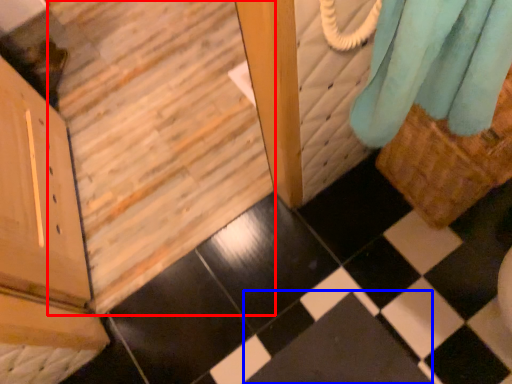
Question: Which object appears closest to the camera in this image, stairwell (highlighted by a red box) or square (highlighted by a blue box)?

Choices:
 (A) stairwell
 (B) square

Answer: (A)